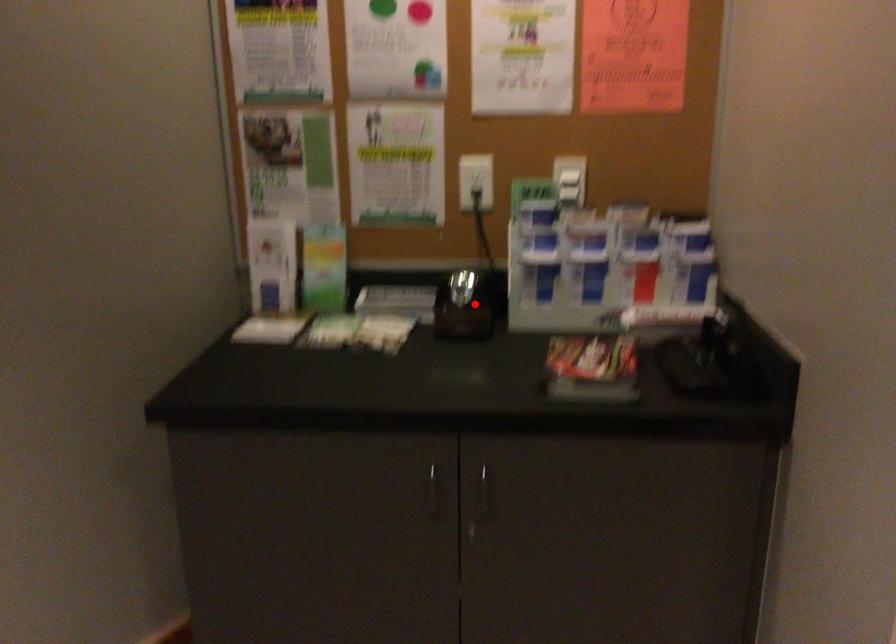
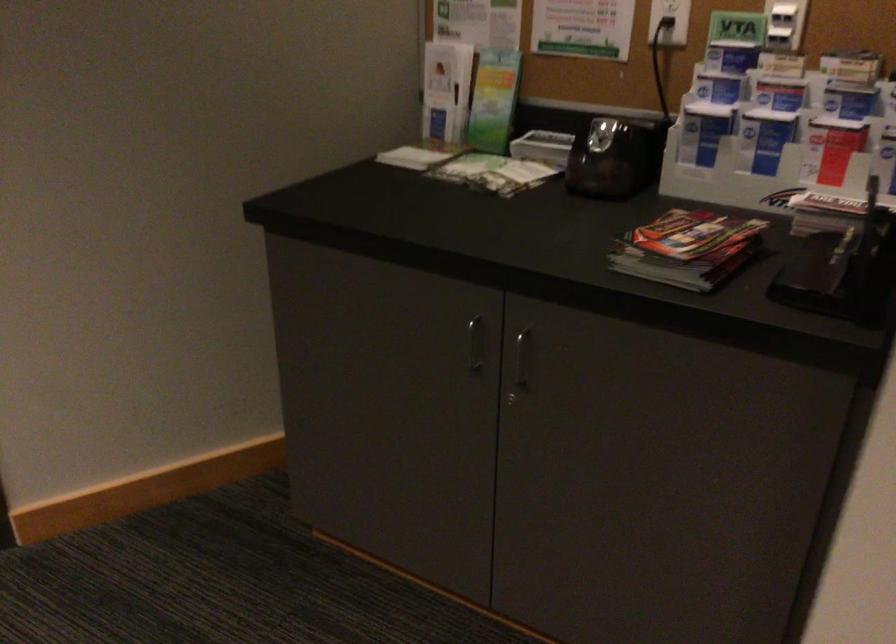
Question: A red point is marked in image1. In image2, is the corresponding 3D point closer to the camera or farther? Reply with the corresponding letter.

Choices:
 (A) The corresponding 3D point is closer.
 (B) The corresponding 3D point is farther.

Answer: (A)